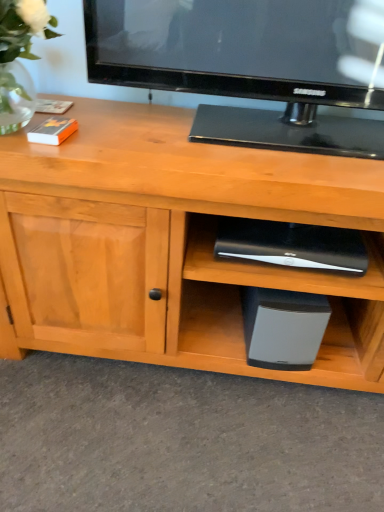
Describe the element at coordinates (20, 42) in the screenshot. I see `clear glass vase at upper left` at that location.

How much space does black plastic speaker at lower center, the second appliance when ordered from bottom to top, occupy vertically?

3.16 inches.

The width and height of the screenshot is (384, 512). Describe the element at coordinates (283, 327) in the screenshot. I see `black matte speaker at lower center, which is the first appliance in bottom-to-top order` at that location.

In order to click on clear glass vase at upper left in this screenshot , I will do `click(20, 42)`.

Considering the sizes of objects black plastic speaker at lower center, placed as the 1th appliance when sorted from top to bottom, and black matte speaker at lower center, the 2th appliance in the top-to-bottom sequence, in the image provided, who is thinner, black plastic speaker at lower center, placed as the 1th appliance when sorted from top to bottom, or black matte speaker at lower center, the 2th appliance in the top-to-bottom sequence,?

With smaller width is black plastic speaker at lower center, placed as the 1th appliance when sorted from top to bottom.

In terms of height, does black plastic speaker at lower center, the second appliance when ordered from bottom to top, look taller or shorter compared to black matte speaker at lower center, which is the first appliance in bottom-to-top order?

Considering their sizes, black plastic speaker at lower center, the second appliance when ordered from bottom to top, has less height than black matte speaker at lower center, which is the first appliance in bottom-to-top order.

Which of these two, black plastic speaker at lower center, the second appliance when ordered from bottom to top, or black matte speaker at lower center, the 2th appliance in the top-to-bottom sequence, is bigger?

With larger size is black matte speaker at lower center, the 2th appliance in the top-to-bottom sequence.

Locate an element on the screen. This screenshot has width=384, height=512. appliance in front of the black matte speaker at lower center, the 2th appliance in the top-to-bottom sequence is located at coordinates (292, 245).

Which object is closer to the camera, clear glass vase at upper left or black matte speaker at lower center, the 2th appliance in the top-to-bottom sequence?

Positioned in front is clear glass vase at upper left.

Between clear glass vase at upper left and black matte speaker at lower center, the 2th appliance in the top-to-bottom sequence, which one has more height?

clear glass vase at upper left.

Could you measure the distance between clear glass vase at upper left and black matte speaker at lower center, the 2th appliance in the top-to-bottom sequence?

A distance of 30.07 inches exists between clear glass vase at upper left and black matte speaker at lower center, the 2th appliance in the top-to-bottom sequence.

Considering the relative sizes of black plastic speaker at lower center, the second appliance when ordered from bottom to top, and clear glass vase at upper left in the image provided, is black plastic speaker at lower center, the second appliance when ordered from bottom to top, smaller than clear glass vase at upper left?

Correct, black plastic speaker at lower center, the second appliance when ordered from bottom to top, occupies less space than clear glass vase at upper left.

Measure the distance from black plastic speaker at lower center, the second appliance when ordered from bottom to top, to clear glass vase at upper left.

black plastic speaker at lower center, the second appliance when ordered from bottom to top, is 24.50 inches from clear glass vase at upper left.

Starting from the clear glass vase at upper left, which appliance is the 1st one behind? Please provide its 2D coordinates.

[(292, 245)]

Which of these two, black plastic speaker at lower center, the second appliance when ordered from bottom to top, or clear glass vase at upper left, is thinner?

With smaller width is black plastic speaker at lower center, the second appliance when ordered from bottom to top.

This screenshot has height=512, width=384. There is a clear glass vase at upper left. What are the coordinates of `the 2nd appliance below it (from a real-world perspective)` in the screenshot? It's located at (283, 327).

Is black matte speaker at lower center, the 2th appliance in the top-to-bottom sequence, in contact with clear glass vase at upper left?

black matte speaker at lower center, the 2th appliance in the top-to-bottom sequence, and clear glass vase at upper left are not in contact.

From a real-world perspective, which is physically above, black matte speaker at lower center, which is the first appliance in bottom-to-top order, or clear glass vase at upper left?

In real-world perspective, clear glass vase at upper left is above.

Which is behind, point (315, 347) or point (9, 113)?

The point (315, 347) is more distant.

Considering the sizes of black matte speaker at lower center, which is the first appliance in bottom-to-top order, and black plastic speaker at lower center, placed as the 1th appliance when sorted from top to bottom, in the image, is black matte speaker at lower center, which is the first appliance in bottom-to-top order, taller or shorter than black plastic speaker at lower center, placed as the 1th appliance when sorted from top to bottom,?

In the image, black matte speaker at lower center, which is the first appliance in bottom-to-top order, appears to be taller than black plastic speaker at lower center, placed as the 1th appliance when sorted from top to bottom.

In the scene shown: Is black matte speaker at lower center, the 2th appliance in the top-to-bottom sequence, with black plastic speaker at lower center, placed as the 1th appliance when sorted from top to bottom?

They are not placed beside each other.

Between point (289, 328) and point (221, 232), which one is positioned behind?

The point (289, 328) is farther from the camera.

Is clear glass vase at upper left inside or outside of black plastic speaker at lower center, the second appliance when ordered from bottom to top?

clear glass vase at upper left is not enclosed by black plastic speaker at lower center, the second appliance when ordered from bottom to top.

Considering the sizes of objects clear glass vase at upper left and black plastic speaker at lower center, the second appliance when ordered from bottom to top, in the image provided, who is wider, clear glass vase at upper left or black plastic speaker at lower center, the second appliance when ordered from bottom to top,?

With larger width is clear glass vase at upper left.

Would you say clear glass vase at upper left is a long distance from black plastic speaker at lower center, placed as the 1th appliance when sorted from top to bottom?

Actually, clear glass vase at upper left and black plastic speaker at lower center, placed as the 1th appliance when sorted from top to bottom, are a little close together.

From the image's perspective, is clear glass vase at upper left on top of black plastic speaker at lower center, the second appliance when ordered from bottom to top?

Yes, from the image's perspective, clear glass vase at upper left is above black plastic speaker at lower center, the second appliance when ordered from bottom to top.

The height and width of the screenshot is (512, 384). What are the coordinates of `appliance above the black matte speaker at lower center, which is the first appliance in bottom-to-top order (from a real-world perspective)` in the screenshot? It's located at (292, 245).

You are a GUI agent. You are given a task and a screenshot of the screen. Output one action in this format:
    pyautogui.click(x=<x>, y=<y>)
    Task: Click on the floral arrangement above the black matte speaker at lower center, the 2th appliance in the top-to-bottom sequence (from the image's perspective)
    
    Given the screenshot: What is the action you would take?
    pyautogui.click(x=20, y=42)

Looking at the image, which one is located further to black plastic speaker at lower center, placed as the 1th appliance when sorted from top to bottom, black matte speaker at lower center, which is the first appliance in bottom-to-top order, or clear glass vase at upper left?

clear glass vase at upper left is positioned further to the anchor black plastic speaker at lower center, placed as the 1th appliance when sorted from top to bottom.

Based on their spatial positions, is clear glass vase at upper left or black plastic speaker at lower center, placed as the 1th appliance when sorted from top to bottom, closer to black matte speaker at lower center, the 2th appliance in the top-to-bottom sequence?

black plastic speaker at lower center, placed as the 1th appliance when sorted from top to bottom, is closer to black matte speaker at lower center, the 2th appliance in the top-to-bottom sequence.

Estimate the real-world distances between objects in this image. Which object is closer to black plastic speaker at lower center, placed as the 1th appliance when sorted from top to bottom, clear glass vase at upper left or black matte speaker at lower center, which is the first appliance in bottom-to-top order?

black matte speaker at lower center, which is the first appliance in bottom-to-top order, is closer to black plastic speaker at lower center, placed as the 1th appliance when sorted from top to bottom.

Considering their positions, is black plastic speaker at lower center, placed as the 1th appliance when sorted from top to bottom, positioned further to black matte speaker at lower center, the 2th appliance in the top-to-bottom sequence, than clear glass vase at upper left?

The object further to black matte speaker at lower center, the 2th appliance in the top-to-bottom sequence, is clear glass vase at upper left.

From the picture: Estimate the real-world distances between objects in this image. Which object is further from clear glass vase at upper left, black matte speaker at lower center, the 2th appliance in the top-to-bottom sequence, or black plastic speaker at lower center, placed as the 1th appliance when sorted from top to bottom?

The object further to clear glass vase at upper left is black matte speaker at lower center, the 2th appliance in the top-to-bottom sequence.

Considering their positions, is black plastic speaker at lower center, the second appliance when ordered from bottom to top, positioned further to clear glass vase at upper left than black matte speaker at lower center, which is the first appliance in bottom-to-top order?

Based on the image, black matte speaker at lower center, which is the first appliance in bottom-to-top order, appears to be further to clear glass vase at upper left.

Identify the location of appliance located between clear glass vase at upper left and black matte speaker at lower center, the 2th appliance in the top-to-bottom sequence, in the left-right direction. (292, 245).